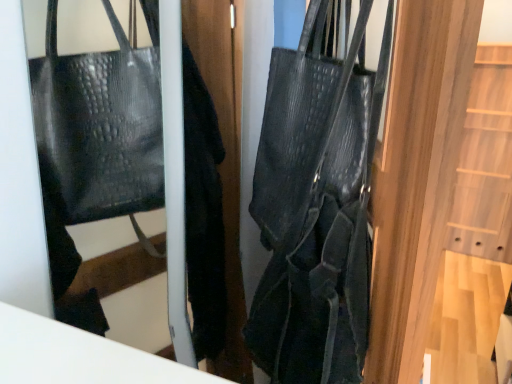
Image resolution: width=512 pixels, height=384 pixels. What do you see at coordinates (316, 205) in the screenshot?
I see `black textured handbag at center` at bounding box center [316, 205].

In order to click on black textured handbag at center in this screenshot , I will do `click(316, 205)`.

Where is `black leather coat at center`? This screenshot has height=384, width=512. black leather coat at center is located at coordinates (225, 151).

What do you see at coordinates (225, 151) in the screenshot? I see `black leather coat at center` at bounding box center [225, 151].

Identify the location of black textured handbag at center. This screenshot has width=512, height=384. (316, 205).

Considering the relative positions of black leather coat at center and black textured handbag at center in the image provided, is black leather coat at center to the right of black textured handbag at center from the viewer's perspective?

No, black leather coat at center is not to the right of black textured handbag at center.

Between black leather coat at center and black textured handbag at center, which one is positioned behind?

black leather coat at center is more distant.

Which is in front, point (214, 27) or point (335, 330)?

The point (335, 330) is closer.

From the image's perspective, who appears lower, black leather coat at center or black textured handbag at center?

black textured handbag at center is shown below in the image.

From a real-world perspective, is black leather coat at center positioned above or below black textured handbag at center?

black leather coat at center is below black textured handbag at center.

Considering the sizes of objects black leather coat at center and black textured handbag at center in the image provided, who is wider, black leather coat at center or black textured handbag at center?

black textured handbag at center is wider.

Considering the sizes of black leather coat at center and black textured handbag at center in the image, is black leather coat at center taller or shorter than black textured handbag at center?

Considering their sizes, black leather coat at center has more height than black textured handbag at center.

Considering the sizes of black leather coat at center and black textured handbag at center in the image, is black leather coat at center bigger or smaller than black textured handbag at center?

In the image, black leather coat at center appears to be smaller than black textured handbag at center.

Is black leather coat at center located outside black textured handbag at center?

That's correct, black leather coat at center is outside of black textured handbag at center.

Is black leather coat at center far from black textured handbag at center?

No.

Is black leather coat at center turned away from black textured handbag at center?

That's not correct — black leather coat at center is not looking away from black textured handbag at center.

Identify the location of door that appears behind the black textured handbag at center. The height and width of the screenshot is (384, 512). (225, 151).

Would you say black textured handbag at center is to the left or to the right of black leather coat at center in the picture?

black textured handbag at center is to the right of black leather coat at center.

Between black textured handbag at center and black leather coat at center, which one is positioned in front?

black textured handbag at center.

Considering the positions of point (386, 56) and point (231, 133), is point (386, 56) closer or farther from the camera than point (231, 133)?

Point (386, 56) appears to be closer to the viewer than point (231, 133).

From the image's perspective, is black textured handbag at center located above black leather coat at center?

Incorrect, from the image's perspective, black textured handbag at center is lower than black leather coat at center.

From a real-world perspective, is black textured handbag at center physically located above or below black leather coat at center?

In terms of real-world spatial position, black textured handbag at center is above black leather coat at center.

Can you confirm if black textured handbag at center is thinner than black leather coat at center?

No, black textured handbag at center is not thinner than black leather coat at center.

Is black textured handbag at center shorter than black leather coat at center?

Yes.

Looking at this image, considering the sizes of objects black textured handbag at center and black leather coat at center in the image provided, who is smaller, black textured handbag at center or black leather coat at center?

Smaller between the two is black leather coat at center.

Is black leather coat at center a part of black textured handbag at center?

Definitely not — black leather coat at center is not inside black textured handbag at center.

Is black textured handbag at center next to black leather coat at center and touching it?

No, black textured handbag at center is not beside black leather coat at center.

Is black textured handbag at center facing away from black leather coat at center?

black textured handbag at center does not have its back to black leather coat at center.

Can you tell me how much black textured handbag at center and black leather coat at center differ in facing direction?

The angular difference between black textured handbag at center and black leather coat at center is 25.8 degrees.

How far apart are black textured handbag at center and black leather coat at center?

black textured handbag at center and black leather coat at center are 21.85 inches apart from each other.

The width and height of the screenshot is (512, 384). I want to click on handbag in front of the black leather coat at center, so click(x=316, y=205).

Locate an element on the screen. This screenshot has width=512, height=384. door above the black textured handbag at center (from the image's perspective) is located at coordinates (225, 151).

At what (x,y) coordinates should I click in order to perform the action: click on door on the left of black textured handbag at center. Please return your answer as a coordinate pair (x, y). The height and width of the screenshot is (384, 512). Looking at the image, I should click on (225, 151).